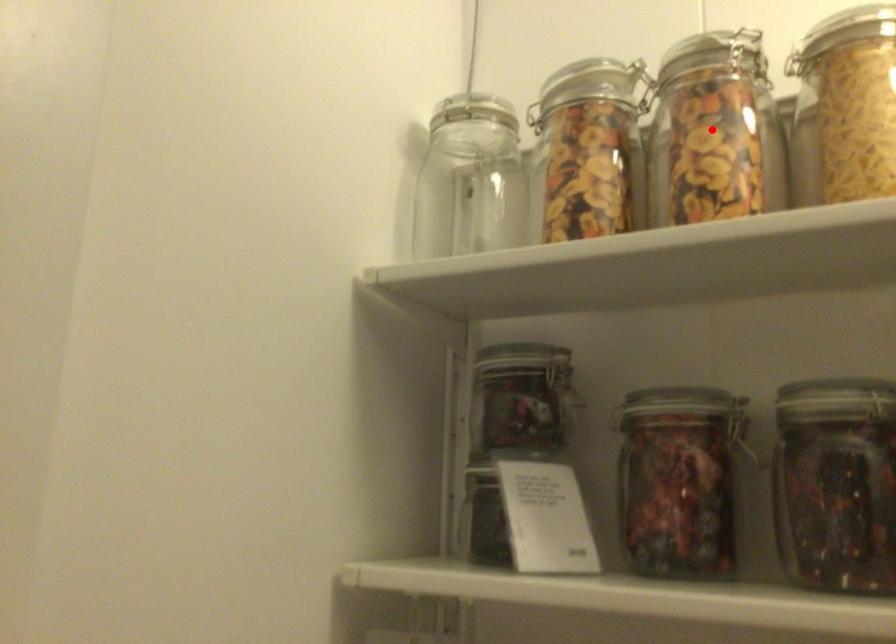
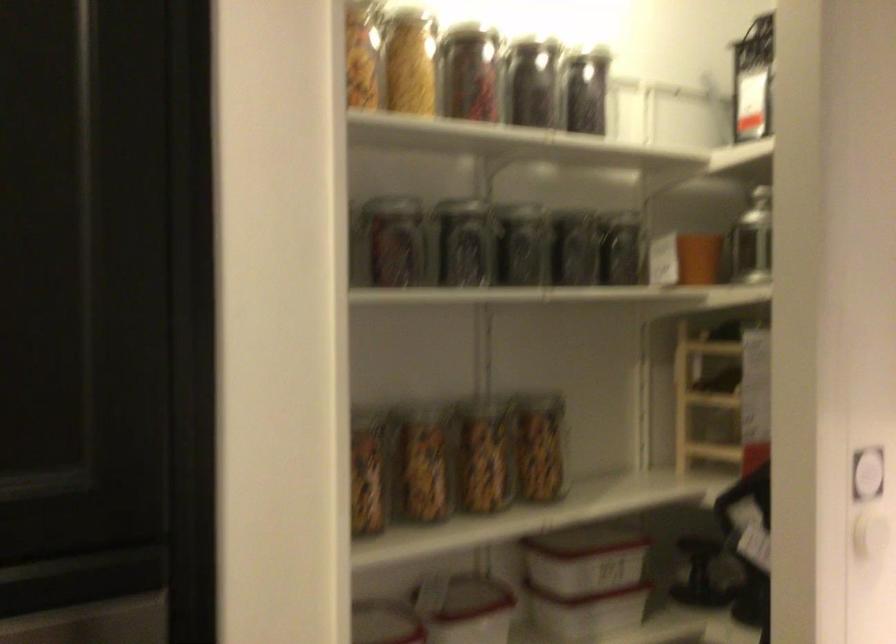
Question: I am providing you with two images of the same scene from different viewpoints. In image1, a red point is highlighted. Considering the same 3D point in image2, which of the following is correct?

Choices:
 (A) It is closer
 (B) It is farther

Answer: (B)